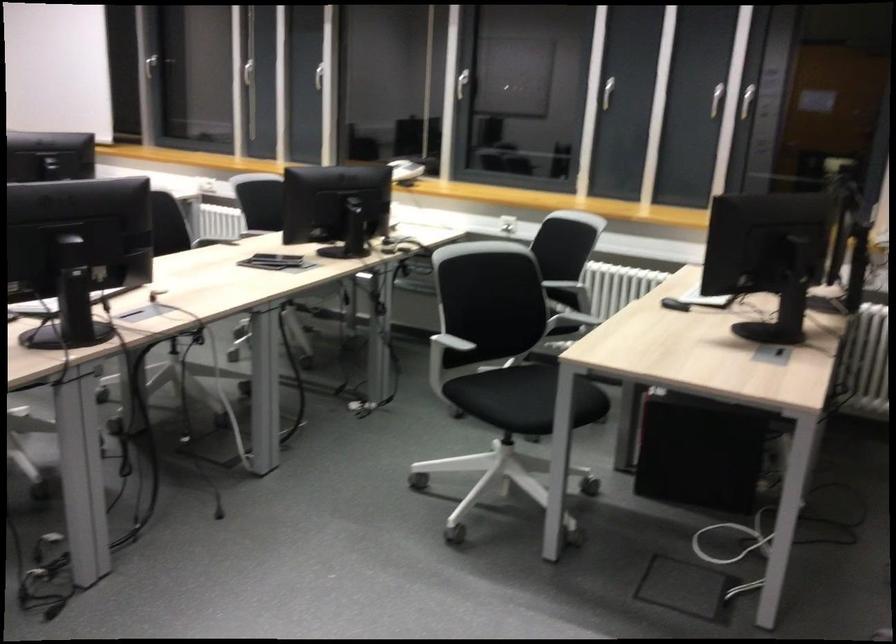
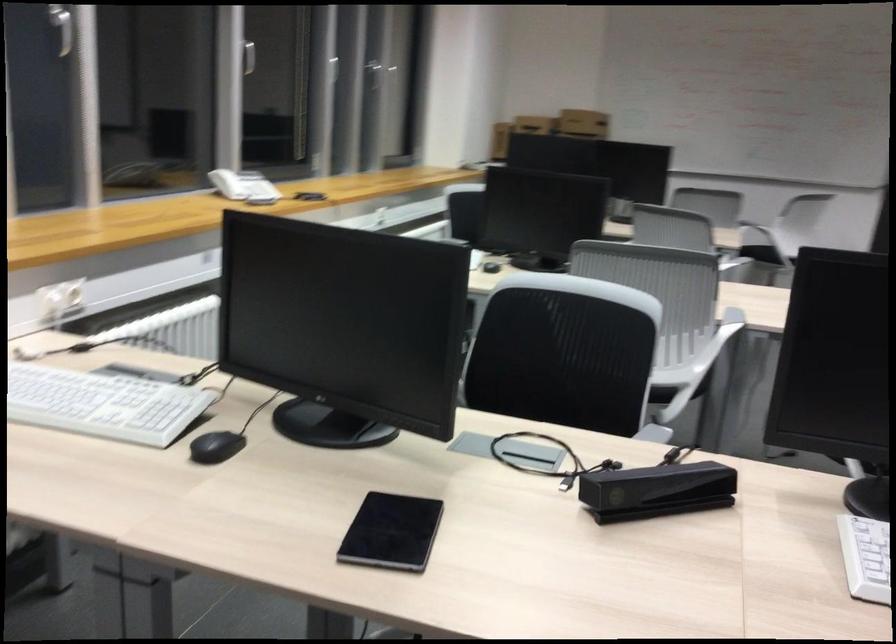
Question: I am providing you with two images of the same scene from different viewpoints. Please identify which objects are invisible in image2.

Choices:
 (A) black computer mouse
 (B) telephone handset
 (C) black chair sitting surface
 (D) woven spherical vase

Answer: (C)